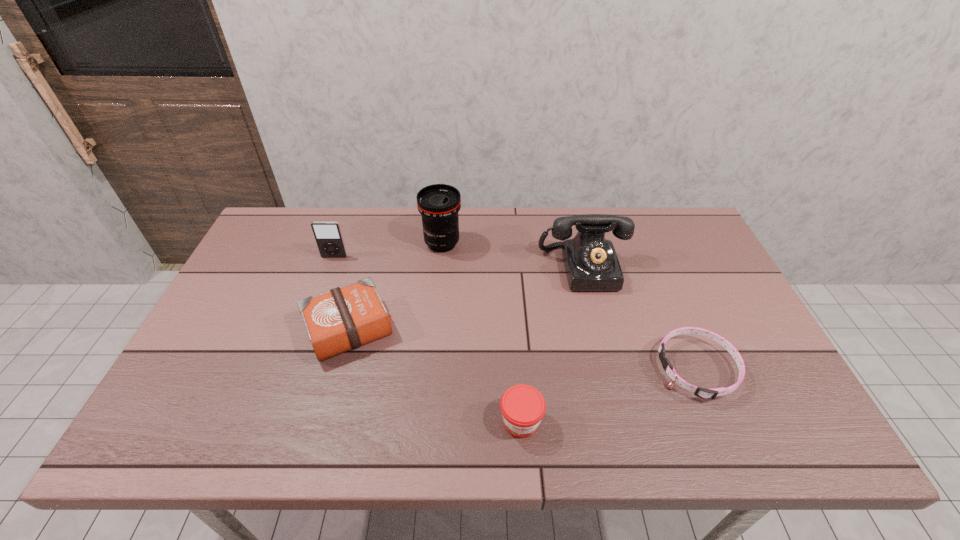
The width and height of the screenshot is (960, 540). In order to click on free location located with the buckle on the dog collar in this screenshot , I will do `click(577, 369)`.

Identify the location of blank area located with the buckle on the dog collar. Image resolution: width=960 pixels, height=540 pixels. (635, 369).

What are the coordinates of `free spot located with the buckle on the dog collar` in the screenshot? It's located at (524, 369).

Identify the location of telephoto lens present at the far edge. Image resolution: width=960 pixels, height=540 pixels. (439, 204).

I want to click on telephone positioned at the far edge, so click(591, 263).

Where is `object positioned at the near edge`? The height and width of the screenshot is (540, 960). object positioned at the near edge is located at coordinates pos(522,406).

You are a GUI agent. You are given a task and a screenshot of the screen. Output one action in this format:
    pyautogui.click(x=<x>, y=<y>)
    Task: Click on the object present at the right edge
    
    Given the screenshot: What is the action you would take?
    pyautogui.click(x=704, y=393)

At what (x,y) coordinates should I click in order to perform the action: click on free space at the far edge of the desktop. Please return your answer as a coordinate pair (x, y). Looking at the image, I should click on (638, 238).

At what (x,y) coordinates should I click in order to perform the action: click on vacant space at the near edge of the desktop. Please return your answer as a coordinate pair (x, y). The width and height of the screenshot is (960, 540). Looking at the image, I should click on (433, 442).

Find the location of a particular element. vacant space at the right edge of the desktop is located at coordinates (705, 286).